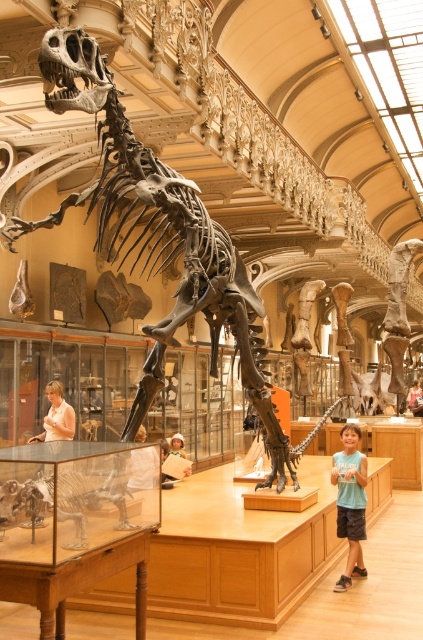
Question: Which of the following is the farthest from the observer?

Choices:
 (A) light blue t-shirt at lower right
 (B) shiny metallic dinosaur at center

Answer: (A)

Question: Does shiny metallic dinosaur at center lie behind light blue t-shirt at lower right?

Choices:
 (A) no
 (B) yes

Answer: (A)

Question: Is shiny metallic dinosaur at center below light blue t-shirt at lower right?

Choices:
 (A) yes
 (B) no

Answer: (B)

Question: Which point is farther from the camera taking this photo?

Choices:
 (A) (356, 460)
 (B) (65, 442)

Answer: (A)

Question: Is shiny metallic dinosaur at center smaller than light blue t-shirt at lower right?

Choices:
 (A) yes
 (B) no

Answer: (B)